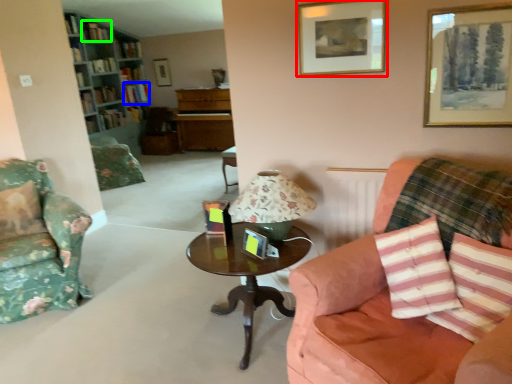
Question: Which is farther away from picture frame (highlighted by a red box)? book (highlighted by a blue box) or book (highlighted by a green box)?

Choices:
 (A) book
 (B) book

Answer: (A)